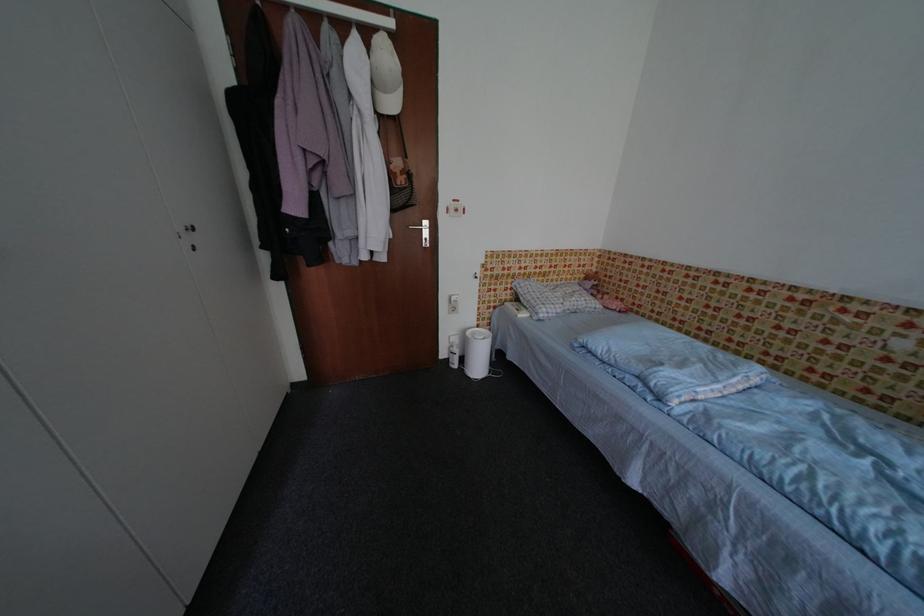
This screenshot has width=924, height=616. Describe the element at coordinates (453, 352) in the screenshot. I see `the spray bottle nozzle` at that location.